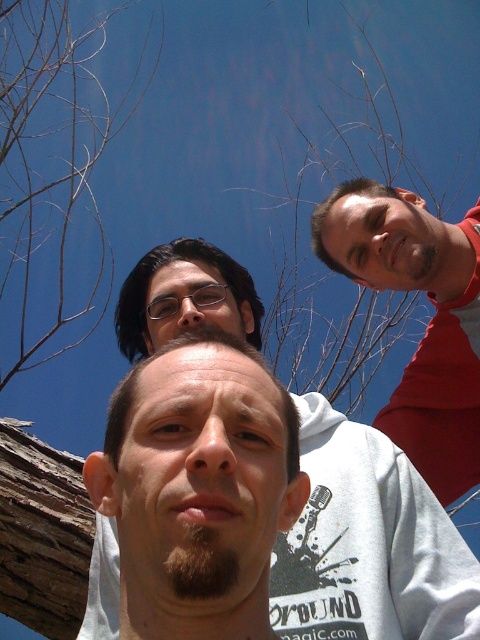
Question: Can you confirm if brownbranch at left is positioned to the left of red matte shirt at upper right?

Choices:
 (A) yes
 (B) no

Answer: (A)

Question: Which object is positioned closest to the light brown hair at center?

Choices:
 (A) brownbranch at left
 (B) red matte shirt at upper right

Answer: (B)

Question: Does white cotton hoodie at center appear on the left side of brownbranch at left?

Choices:
 (A) no
 (B) yes

Answer: (A)

Question: Which object is the farthest from the red matte shirt at upper right?

Choices:
 (A) light brown hair at center
 (B) white cotton hoodie at center

Answer: (A)

Question: Is white cotton hoodie at center positioned in front of light brown hair at center?

Choices:
 (A) yes
 (B) no

Answer: (B)

Question: Which point appears farthest from the camera in this image?

Choices:
 (A) (364, 634)
 (B) (104, 99)
 (C) (145, 630)
 (D) (477, 209)

Answer: (B)